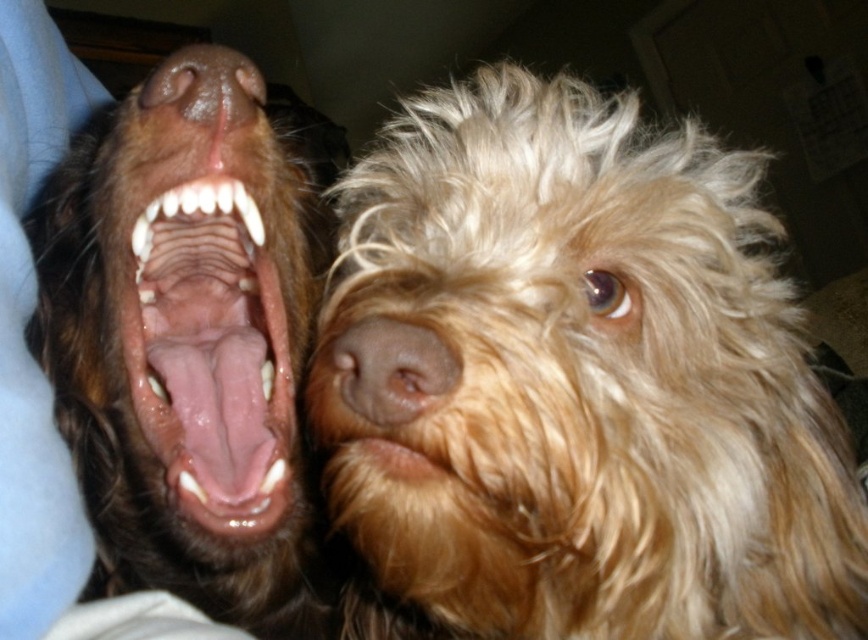
Question: In this image, where is pink flesh-colored teeth at left located relative to brown soft fur nose at center?

Choices:
 (A) right
 (B) left

Answer: (B)

Question: Which object is farther from the camera taking this photo?

Choices:
 (A) brown glossy teeth at upper left
 (B) fuzzy golden dog at center
 (C) dry fur at center
 (D) brown soft fur nose at center

Answer: (A)

Question: Does brown glossy teeth at upper left come behind brown soft fur nose at center?

Choices:
 (A) yes
 (B) no

Answer: (A)

Question: Considering the relative positions of pink flesh-colored teeth at left and dry fur at center in the image provided, where is pink flesh-colored teeth at left located with respect to dry fur at center?

Choices:
 (A) below
 (B) above

Answer: (B)

Question: Which point is farther to the camera?

Choices:
 (A) (234, 52)
 (B) (411, 472)
 (C) (428, 356)

Answer: (A)

Question: Which point is closer to the camera?

Choices:
 (A) pink smooth nose at upper left
 (B) brown soft fur nose at center

Answer: (B)